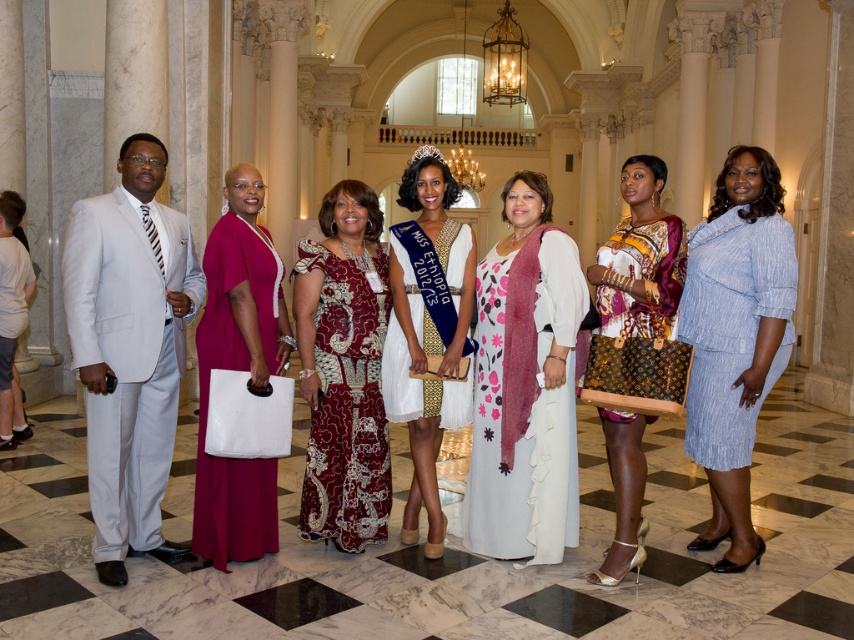
Does floral-patterned dress at center have a lesser height compared to printed silk dress at center?

Incorrect, floral-patterned dress at center's height does not fall short of printed silk dress at center's.

From the picture: Does floral-patterned dress at center lie in front of printed silk dress at center?

No, floral-patterned dress at center is behind printed silk dress at center.

Is point (524, 285) closer to camera compared to point (671, 284)?

No, it is behind (671, 284).

Image resolution: width=854 pixels, height=640 pixels. Identify the location of floral-patterned dress at center. (525, 387).

Looking at this image, does white satin dress at center appear over printed fabric dress at center?

No.

Which of these two, white satin dress at center or printed fabric dress at center, stands taller?

white satin dress at center is taller.

This screenshot has width=854, height=640. In order to click on white satin dress at center in this screenshot , I will do [427, 330].

Is light gray suit at left closer to the viewer compared to printed fabric dress at center?

That is True.

Can you confirm if light gray suit at left is thinner than printed fabric dress at center?

In fact, light gray suit at left might be wider than printed fabric dress at center.

Where is `light gray suit at left`? The image size is (854, 640). light gray suit at left is located at coordinates (129, 348).